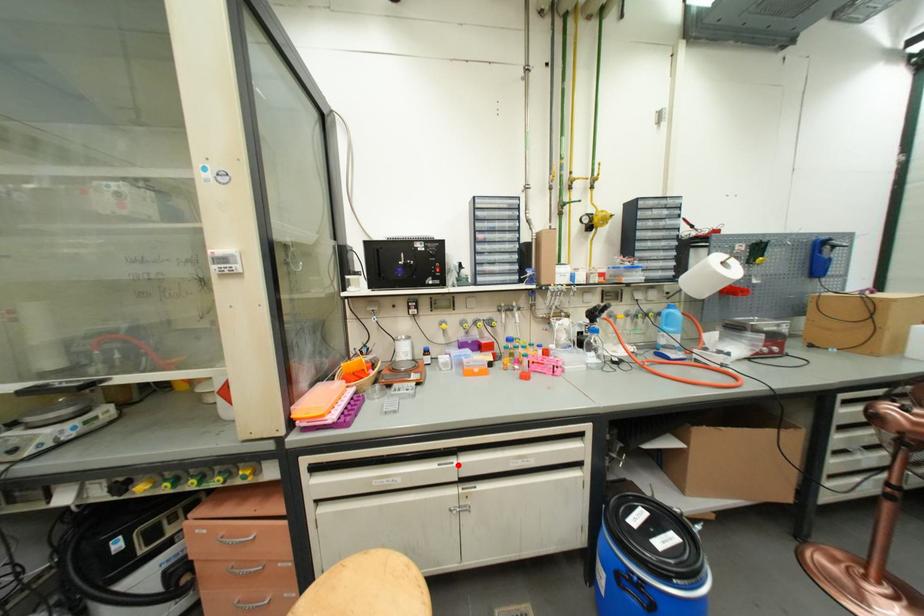
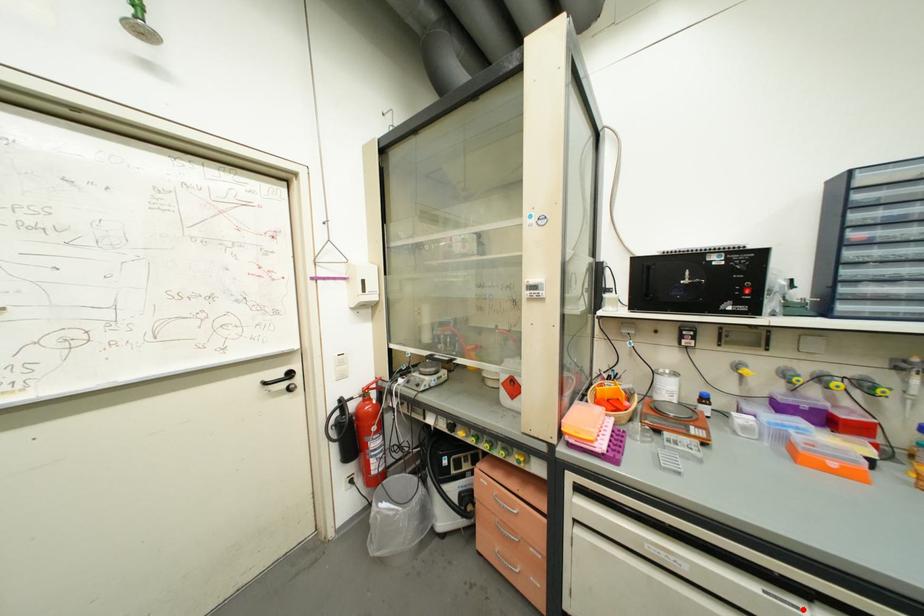
I am providing you with two images of the same scene from different viewpoints. A red point is marked on the first image and another point is marked on the second image. Is the red point in image1 aligned with the point shown in image2?

Yes